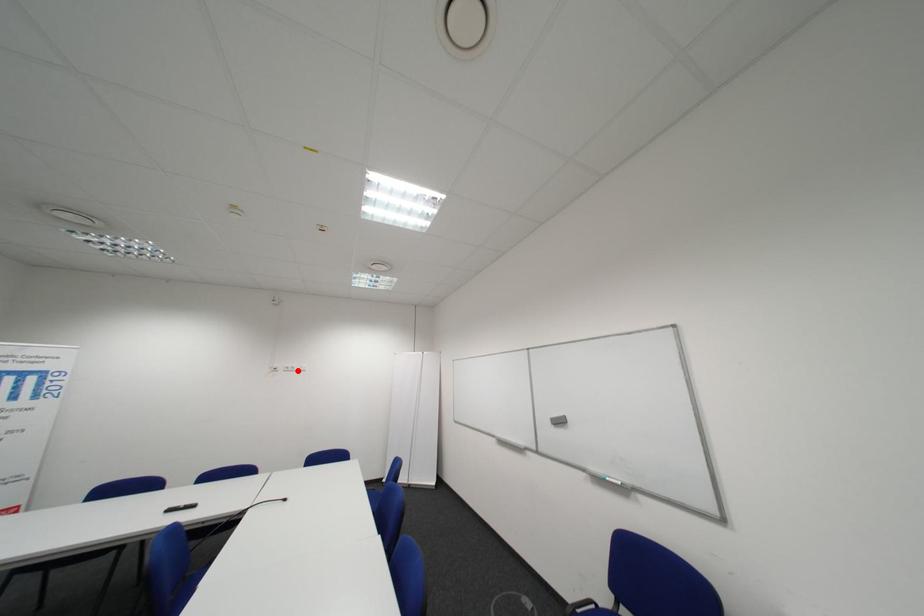
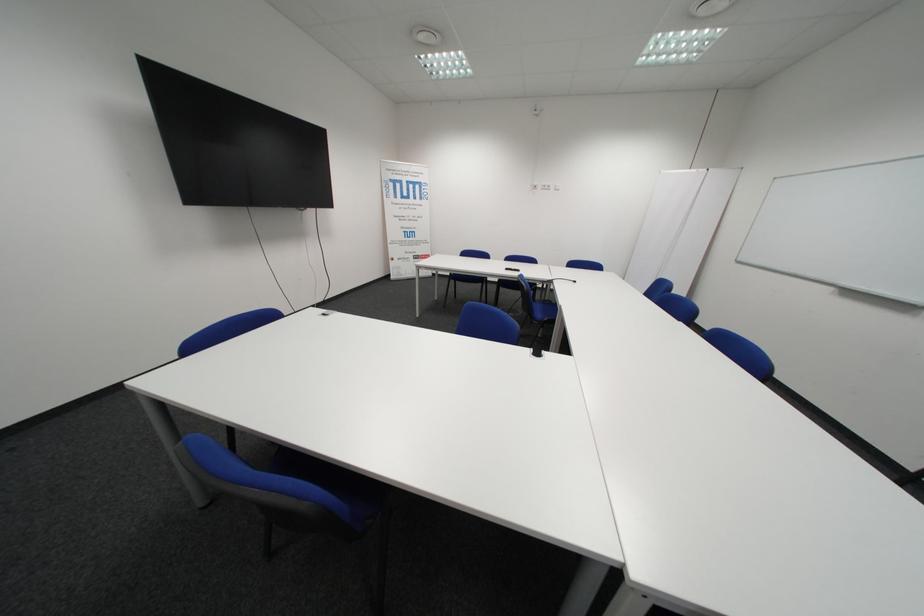
Locate, in the second image, the point that corresponds to the highlighted location in the first image.

(554, 188)